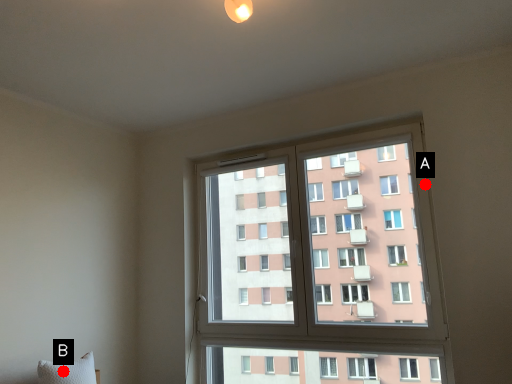
Question: Two points are circled on the image, labeled by A and B beside each circle. Which of the following is the farthest from the observer?

Choices:
 (A) A is further
 (B) B is further

Answer: (A)